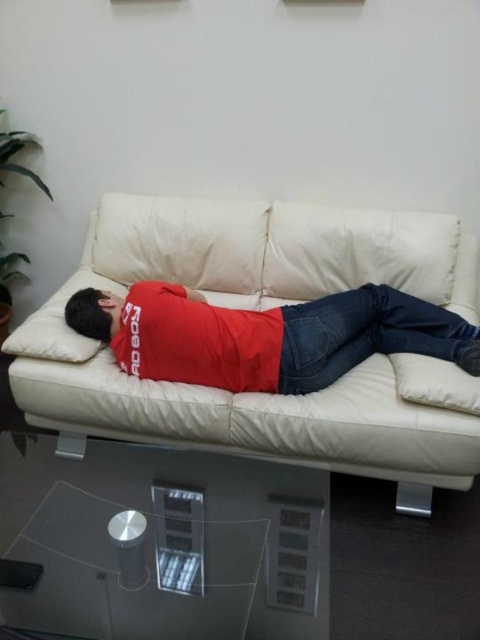
Question: Can you confirm if transparent glass table at lower center is thinner than matte red shirt at center?

Choices:
 (A) yes
 (B) no

Answer: (A)

Question: Which point appears farthest from the camera in this image?

Choices:
 (A) (296, 378)
 (B) (230, 436)
 (C) (84, 513)

Answer: (B)

Question: Which of these objects is positioned closest to the matte red shirt at center?

Choices:
 (A) white leather couch at center
 (B) transparent glass table at lower center

Answer: (A)

Question: Which is nearer to the transparent glass table at lower center?

Choices:
 (A) matte red shirt at center
 (B) white leather couch at center

Answer: (B)

Question: From the image, what is the correct spatial relationship of white leather couch at center in relation to transparent glass table at lower center?

Choices:
 (A) above
 (B) below

Answer: (A)

Question: Can you confirm if transparent glass table at lower center is positioned to the right of matte red shirt at center?

Choices:
 (A) no
 (B) yes

Answer: (A)